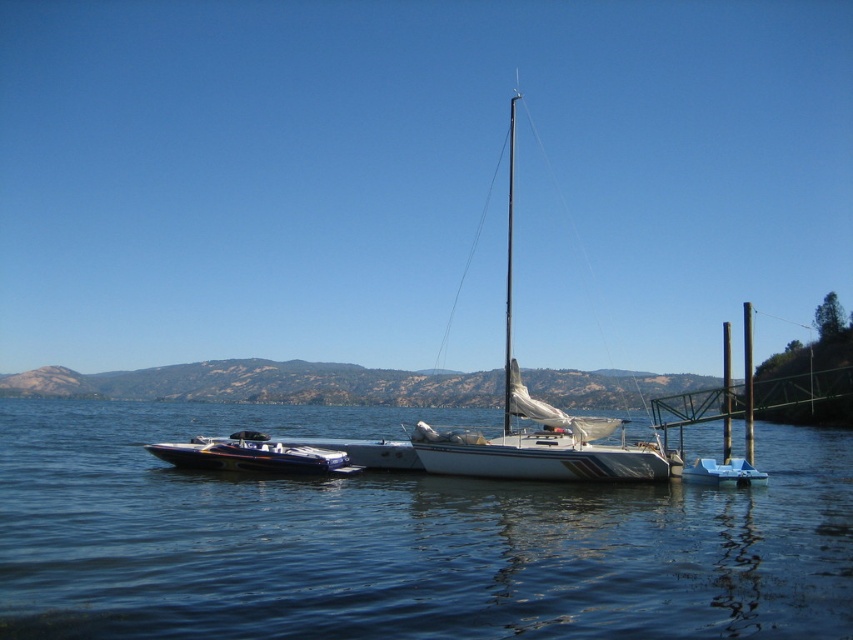
Question: Which object is farther from the camera taking this photo?

Choices:
 (A) blue plastic boat at lower right
 (B) clear water at center
 (C) white matte sailboat at center

Answer: (A)

Question: Does clear water at center have a smaller size compared to white matte sailboat at center?

Choices:
 (A) no
 (B) yes

Answer: (B)

Question: Which point appears farthest from the camera in this image?

Choices:
 (A) (740, 461)
 (B) (622, 474)
 (C) (219, 461)
 (D) (566, 595)

Answer: (A)

Question: Where is white matte sailboat at center located in relation to glossy blue boat at lower left in the image?

Choices:
 (A) left
 (B) right

Answer: (B)

Question: Which object appears farthest from the camera in this image?

Choices:
 (A) glossy blue boat at lower left
 (B) clear water at center
 (C) blue plastic boat at lower right
 (D) white matte sailboat at center

Answer: (C)

Question: Does white matte sailboat at center have a lesser width compared to glossy blue boat at lower left?

Choices:
 (A) yes
 (B) no

Answer: (B)